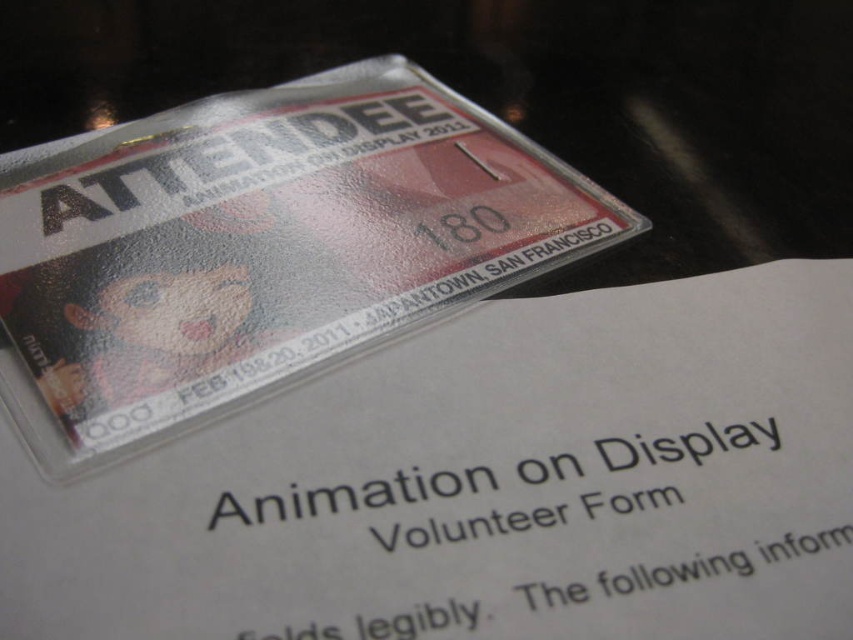
In the scene shown: Can you confirm if white glossy paper at upper center is thinner than glossy plastic badge at upper center?

No, white glossy paper at upper center is not thinner than glossy plastic badge at upper center.

Where is `white glossy paper at upper center`? This screenshot has height=640, width=853. white glossy paper at upper center is located at coordinates (488, 484).

Find the location of a particular element. The height and width of the screenshot is (640, 853). white glossy paper at upper center is located at coordinates (488, 484).